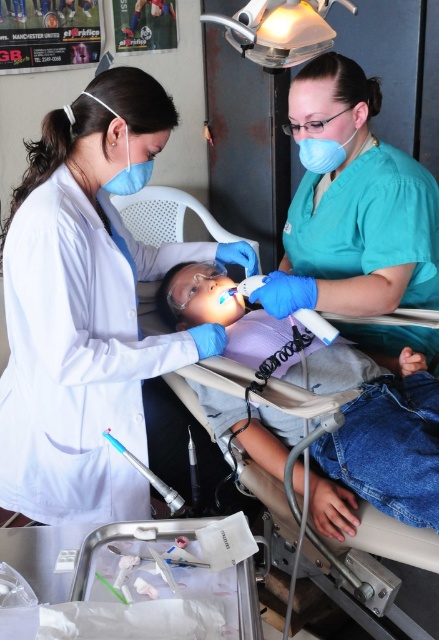
Is smooth purple shirt at center to the left of matte blue mask at upper left from the viewer's perspective?

No, smooth purple shirt at center is not to the left of matte blue mask at upper left.

Who is shorter, smooth purple shirt at center or matte blue mask at upper left?

Standing shorter between the two is matte blue mask at upper left.

The image size is (439, 640). What are the coordinates of `smooth purple shirt at center` in the screenshot? It's located at (375, 442).

Who is more forward, (349, 138) or (144, 182)?

Point (144, 182)

Does point (316, 157) come closer to viewer compared to point (125, 195)?

Yes, it is.

Who is more forward, (302, 145) or (129, 161)?

Point (129, 161)

Where is `blue fabric mask at upper center`? blue fabric mask at upper center is located at coordinates (x=321, y=154).

Can you confirm if smooth purple shirt at center is positioned above blue fabric mask at upper center?

Incorrect, smooth purple shirt at center is not positioned above blue fabric mask at upper center.

Does smooth purple shirt at center have a greater width compared to blue fabric mask at upper center?

Indeed, smooth purple shirt at center has a greater width compared to blue fabric mask at upper center.

Is point (180, 328) in front of point (309, 145)?

No, it is behind (309, 145).

Identify the location of smooth purple shirt at center. This screenshot has width=439, height=640. (375, 442).